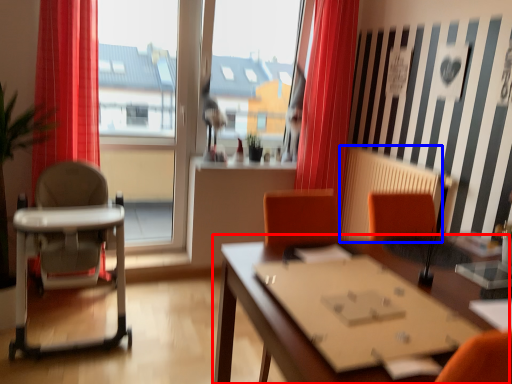
Question: Which object appears closest to the camera in this image, table (highlighted by a red box) or radiator (highlighted by a blue box)?

Choices:
 (A) table
 (B) radiator

Answer: (A)